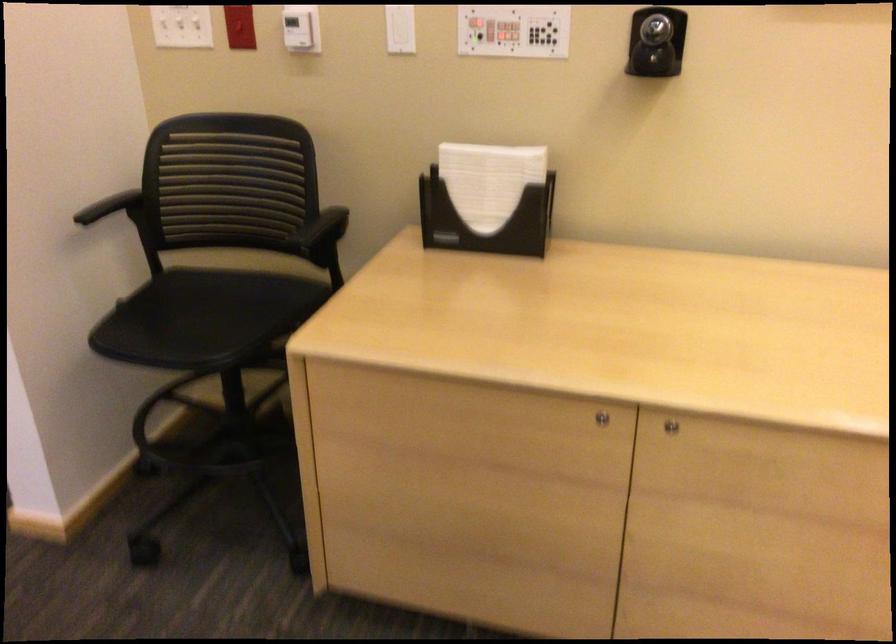
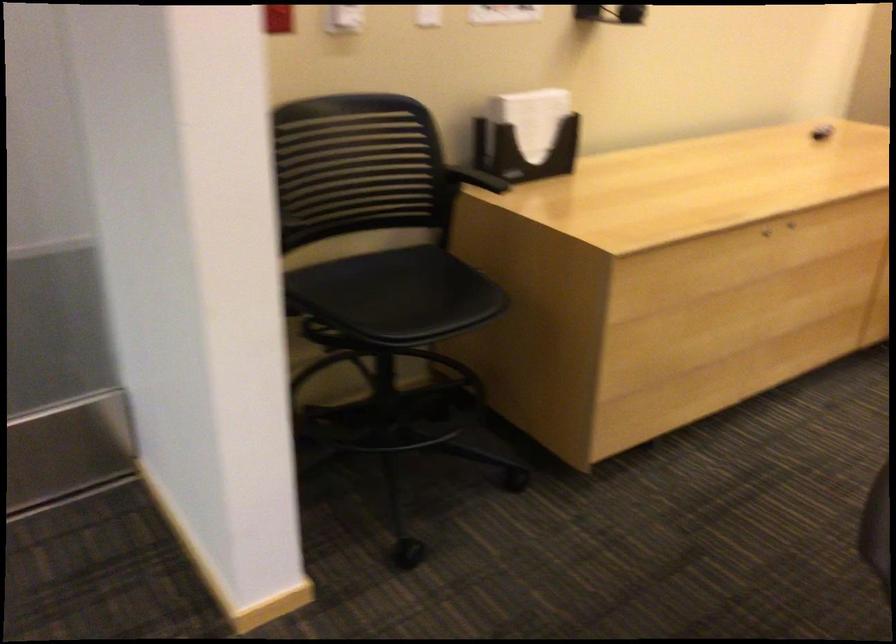
Locate, in the second image, the point that corresponds to (x=487, y=185) in the first image.

(531, 118)